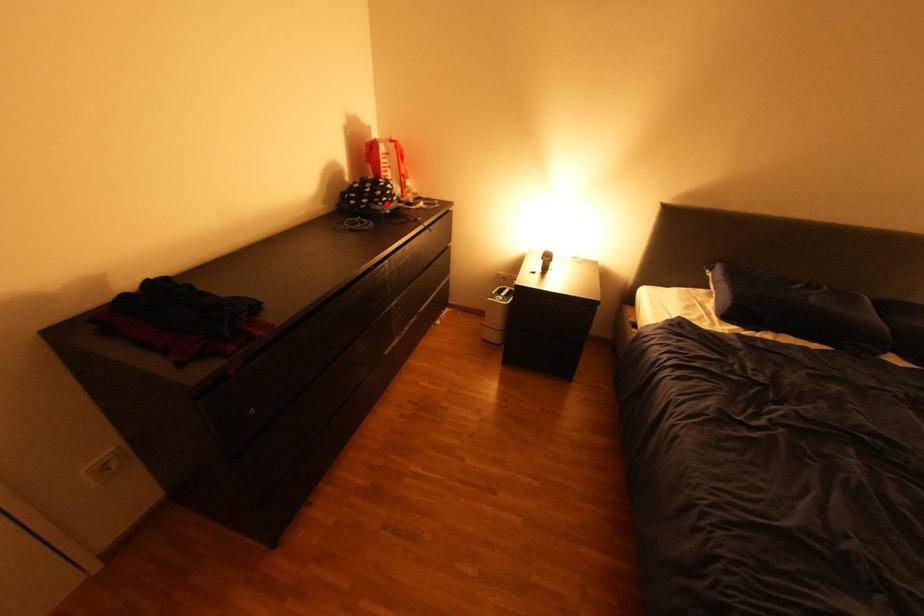
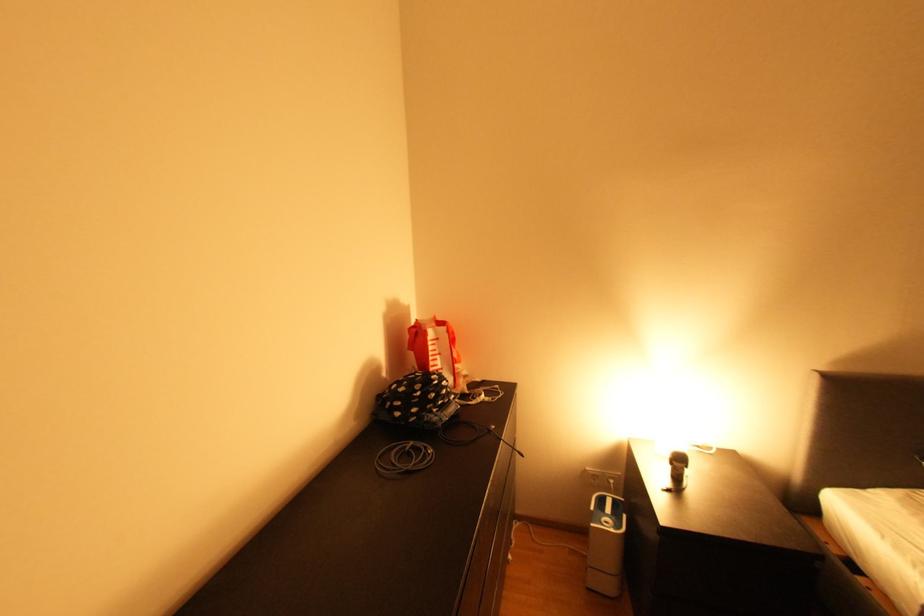
Locate, in the second image, the point that corresponds to the highlighted location in the first image.

(441, 411)